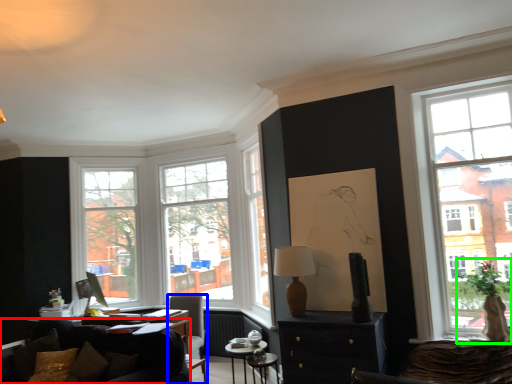
Question: Which object is the closest to the studio couch (highlighted by a red box)? Choose among these: chair (highlighted by a blue box) or houseplant (highlighted by a green box).

Choices:
 (A) chair
 (B) houseplant

Answer: (A)